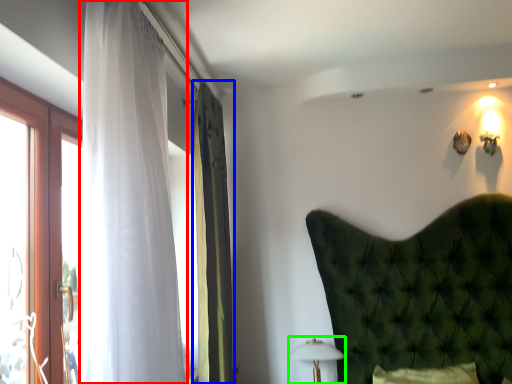
Question: Estimate the real-world distances between objects in this image. Which object is closer to curtain (highlighted by a red box), curtain (highlighted by a blue box) or table lamp (highlighted by a green box)?

Choices:
 (A) curtain
 (B) table lamp

Answer: (A)